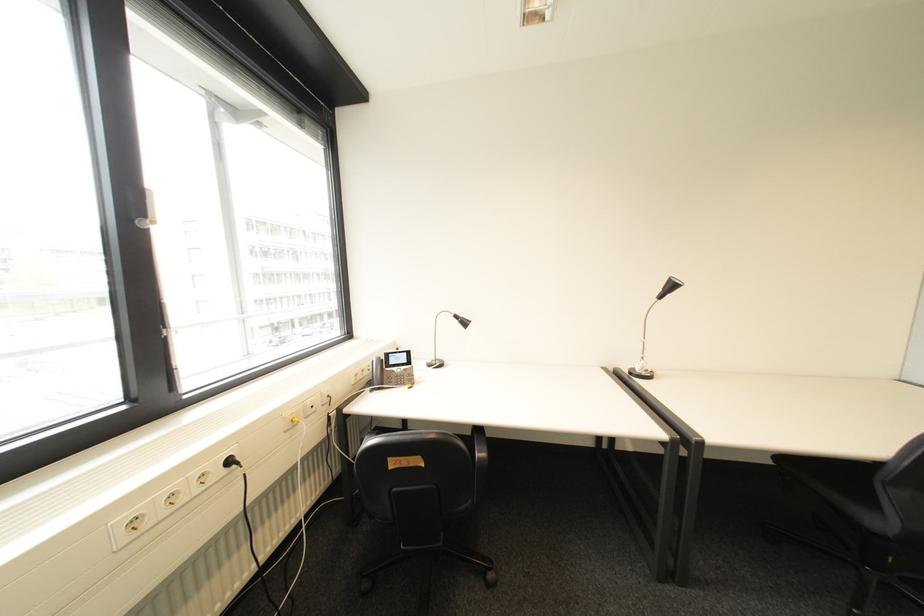
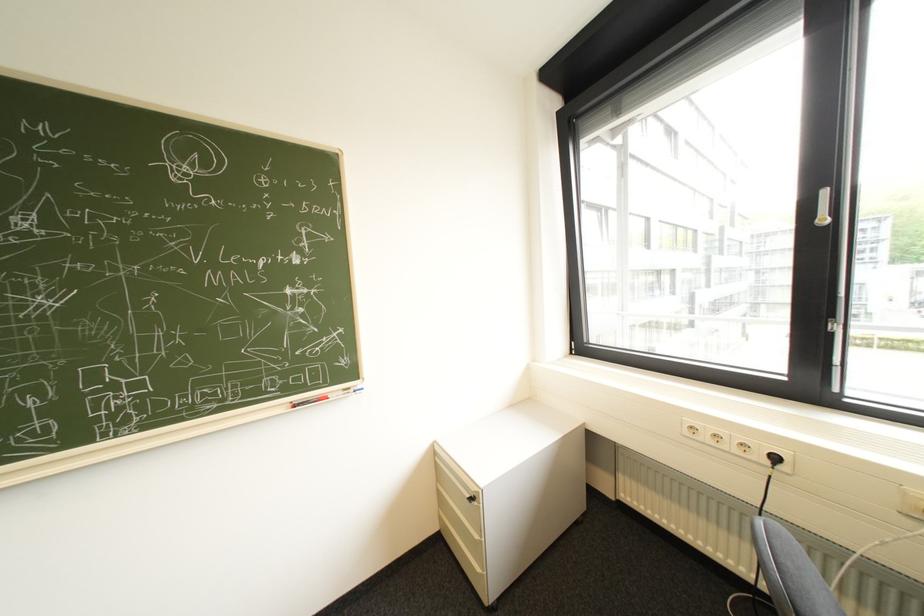
Locate, in the second image, the point that corresponds to (200,500) in the first image.

(737, 450)